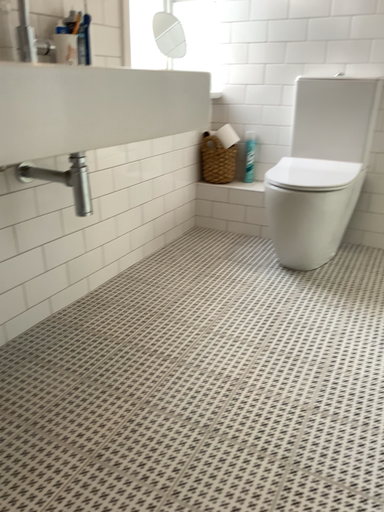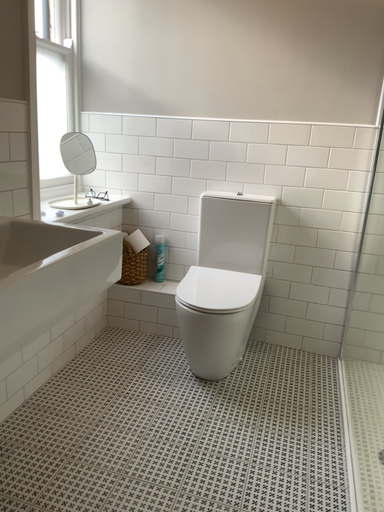
Question: Which way did the camera rotate in the video?

Choices:
 (A) rotated right
 (B) rotated left

Answer: (A)